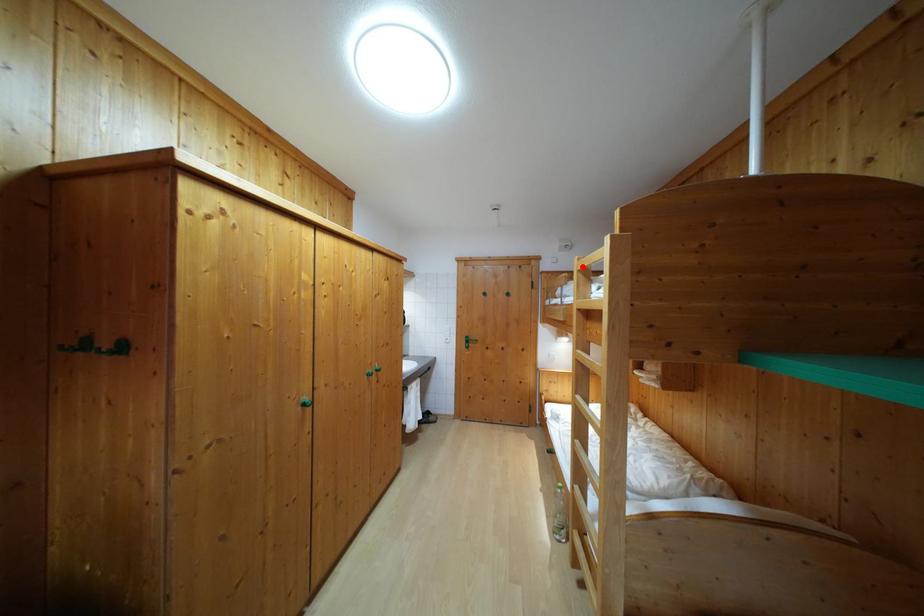
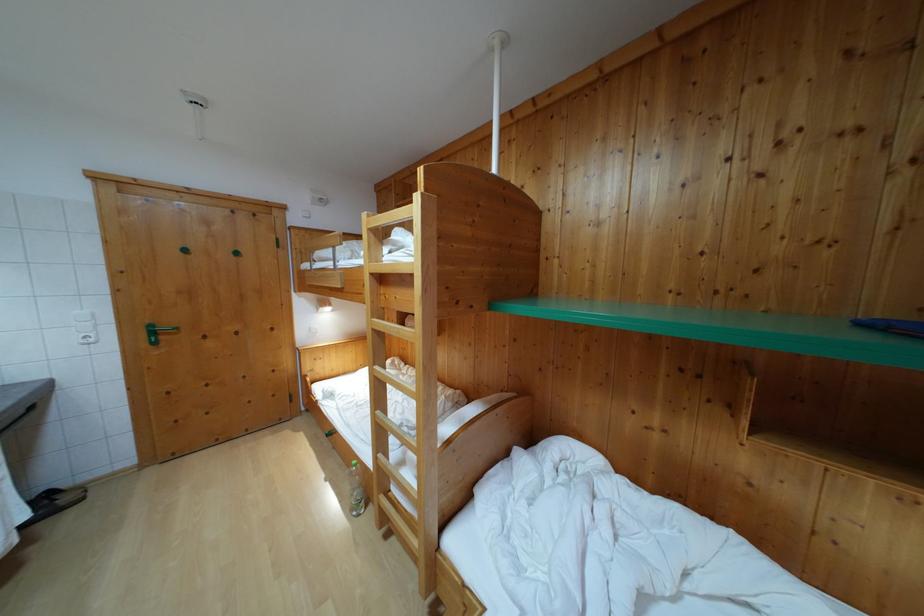
Where in the second image is the point corresponding to the highlighted location from the first image?

(371, 223)